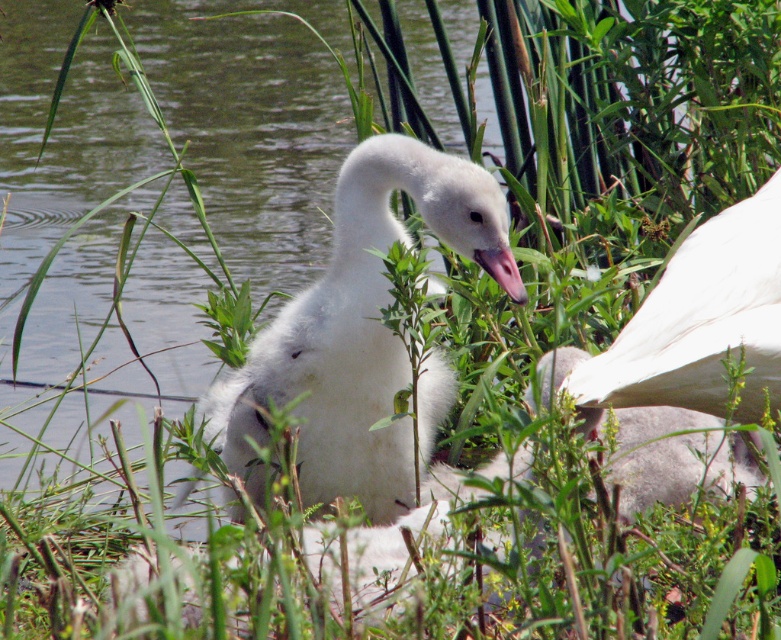
Question: Does white fluffy swan at center have a greater width compared to pink glossy beak at center?

Choices:
 (A) no
 (B) yes

Answer: (B)

Question: Can you confirm if white fluffy swan at center is thinner than white fluffy duck at upper right?

Choices:
 (A) no
 (B) yes

Answer: (A)

Question: Which object appears closest to the camera in this image?

Choices:
 (A) white fluffy swan at center
 (B) pink glossy beak at center

Answer: (B)

Question: Which point is closer to the camera?

Choices:
 (A) pink glossy beak at center
 (B) white fluffy duck at upper right
 (C) white fluffy swan at center

Answer: (A)

Question: Which point is farther from the camera taking this photo?

Choices:
 (A) (490, 256)
 (B) (380, 490)

Answer: (B)

Question: Is white fluffy duck at upper right positioned at the back of pink glossy beak at center?

Choices:
 (A) no
 (B) yes

Answer: (B)